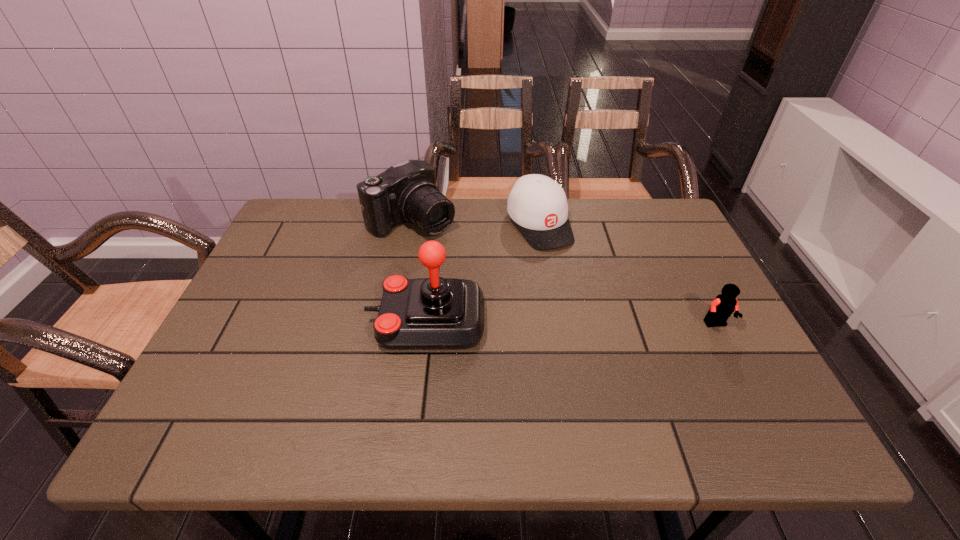
This screenshot has width=960, height=540. In order to click on free location at the right edge of the desktop in this screenshot , I will do [x=702, y=306].

You are a GUI agent. You are given a task and a screenshot of the screen. Output one action in this format:
    pyautogui.click(x=<x>, y=<y>)
    Task: Click on the free space at the far right corner of the desktop
    The image size is (960, 540).
    Given the screenshot: What is the action you would take?
    pyautogui.click(x=651, y=241)

Image resolution: width=960 pixels, height=540 pixels. What are the coordinates of `vacant space at the near right corner` in the screenshot? It's located at (753, 380).

What are the coordinates of `empty space between the second object from right to left and the joystick` in the screenshot? It's located at (483, 273).

At what (x,y) coordinates should I click in order to perform the action: click on free spot between the joystick and the camera. Please return your answer as a coordinate pair (x, y). Looking at the image, I should click on (x=419, y=271).

At what (x,y) coordinates should I click in order to perform the action: click on free space that is in between the third shortest object and the Lego. Please return your answer as a coordinate pair (x, y). Looking at the image, I should click on (564, 273).

Identify the location of vacant space that is in between the baseball cap and the camera. (x=475, y=223).

Locate an element on the screen. free space between the joystick and the second tallest object is located at coordinates (419, 271).

Find the location of a particular element. This screenshot has width=960, height=540. free space between the joystick and the third object from left to right is located at coordinates (483, 273).

Where is `vacant area between the Lego and the third object from left to right`? The image size is (960, 540). vacant area between the Lego and the third object from left to right is located at coordinates (628, 275).